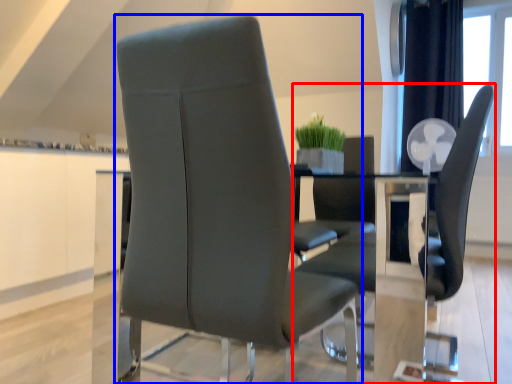
Question: Which point is further to the camera, chair (highlighted by a red box) or chair (highlighted by a blue box)?

Choices:
 (A) chair
 (B) chair

Answer: (A)